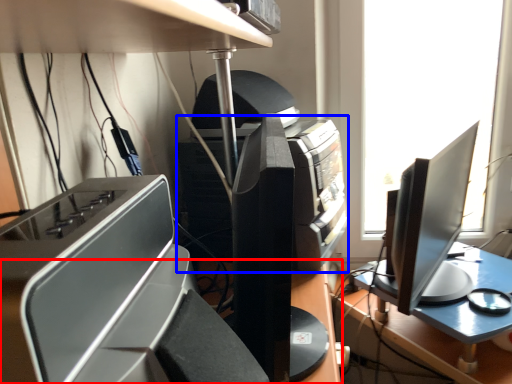
Question: Among these objects, which one is farthest to the camera, desk (highlighted by a red box) or printer (highlighted by a blue box)?

Choices:
 (A) desk
 (B) printer

Answer: (B)